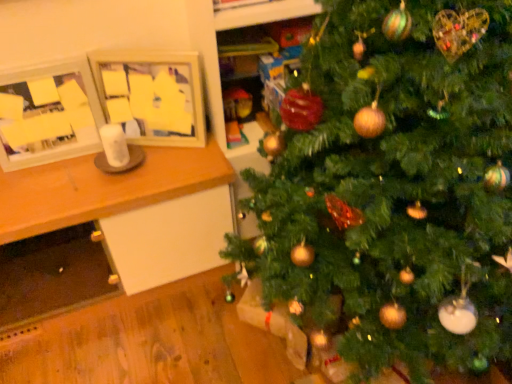
Question: Does green matte christmas tree at center have a greater width compared to wooden picture frame at upper left, marked as the 1th picture frame in a right-to-left arrangement?

Choices:
 (A) yes
 (B) no

Answer: (A)

Question: Is green matte christmas tree at center surrounding wooden picture frame at upper left, marked as the 1th picture frame in a right-to-left arrangement?

Choices:
 (A) no
 (B) yes

Answer: (A)

Question: Is green matte christmas tree at center further to camera compared to wooden picture frame at upper left, marked as the 1th picture frame in a right-to-left arrangement?

Choices:
 (A) no
 (B) yes

Answer: (A)

Question: Is green matte christmas tree at center smaller than wooden picture frame at upper left, acting as the second picture frame starting from the left?

Choices:
 (A) yes
 (B) no

Answer: (B)

Question: Can you confirm if green matte christmas tree at center is shorter than wooden picture frame at upper left, marked as the 1th picture frame in a right-to-left arrangement?

Choices:
 (A) no
 (B) yes

Answer: (A)

Question: Do you think wooden table at left is within wooden picture frame at upper left, marked as the 1th picture frame in a right-to-left arrangement, or outside of it?

Choices:
 (A) outside
 (B) inside

Answer: (A)

Question: Considering the positions of point tap(157, 201) and point tap(195, 96), is point tap(157, 201) closer or farther from the camera than point tap(195, 96)?

Choices:
 (A) farther
 (B) closer

Answer: (B)

Question: Based on their sizes in the image, would you say wooden table at left is bigger or smaller than wooden picture frame at upper left, marked as the 1th picture frame in a right-to-left arrangement?

Choices:
 (A) small
 (B) big

Answer: (B)

Question: From the image's perspective, is wooden table at left above or below wooden picture frame at upper left, acting as the second picture frame starting from the left?

Choices:
 (A) above
 (B) below

Answer: (B)

Question: Considering the relative positions of wooden picture frame at upper left, marked as the 1th picture frame in a right-to-left arrangement, and green matte christmas tree at center in the image provided, is wooden picture frame at upper left, marked as the 1th picture frame in a right-to-left arrangement, to the left or to the right of green matte christmas tree at center?

Choices:
 (A) right
 (B) left

Answer: (B)

Question: From a real-world perspective, relative to green matte christmas tree at center, is wooden picture frame at upper left, acting as the second picture frame starting from the left, vertically above or below?

Choices:
 (A) below
 (B) above

Answer: (B)

Question: Based on their sizes in the image, would you say wooden picture frame at upper left, acting as the second picture frame starting from the left, is bigger or smaller than green matte christmas tree at center?

Choices:
 (A) small
 (B) big

Answer: (A)

Question: From the image's perspective, is wooden picture frame at upper left, marked as the 1th picture frame in a right-to-left arrangement, located above or below green matte christmas tree at center?

Choices:
 (A) above
 (B) below

Answer: (A)

Question: In terms of width, does wooden picture frame at upper left, acting as the second picture frame starting from the left, look wider or thinner when compared to wooden table at left?

Choices:
 (A) thin
 (B) wide

Answer: (A)

Question: Is point (163, 104) positioned closer to the camera than point (13, 175)?

Choices:
 (A) closer
 (B) farther

Answer: (B)